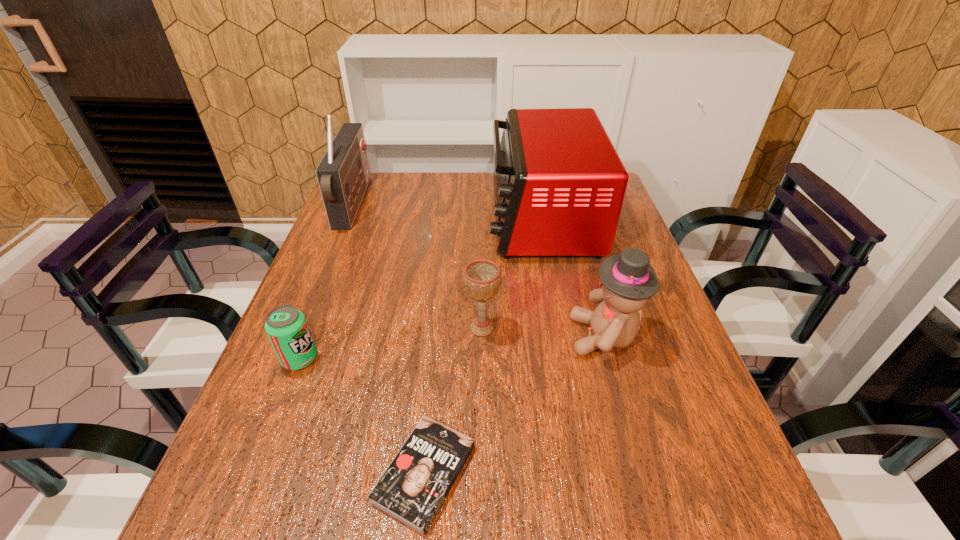
Where is `the fourth closest object to the book`? the fourth closest object to the book is located at coordinates (559, 185).

Where is `vacant space that satisfies the following two spatial constraints: 1. on the back side of the shortest object; 2. on the front-facing side of the pop soda`? The height and width of the screenshot is (540, 960). vacant space that satisfies the following two spatial constraints: 1. on the back side of the shortest object; 2. on the front-facing side of the pop soda is located at coordinates (436, 359).

Find the location of a particular element. The height and width of the screenshot is (540, 960). blank area in the image that satisfies the following two spatial constraints: 1. on the front panel of the radio receiver; 2. on the left side of the shortest object is located at coordinates (244, 474).

The width and height of the screenshot is (960, 540). In order to click on vacant region that satisfies the following two spatial constraints: 1. on the back side of the chalice; 2. on the front panel of the radio receiver in this screenshot , I will do `click(481, 204)`.

Identify the location of vacant space that satisfies the following two spatial constraints: 1. on the front-facing side of the shortest object; 2. on the right side of the pop soda. This screenshot has height=540, width=960. (255, 474).